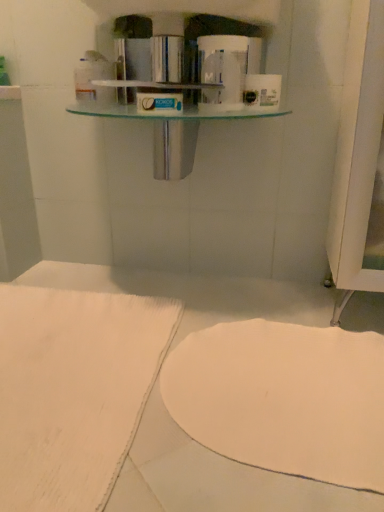
The width and height of the screenshot is (384, 512). I want to click on vacant space situated above white fabric at lower left (from a real-world perspective), so click(x=75, y=353).